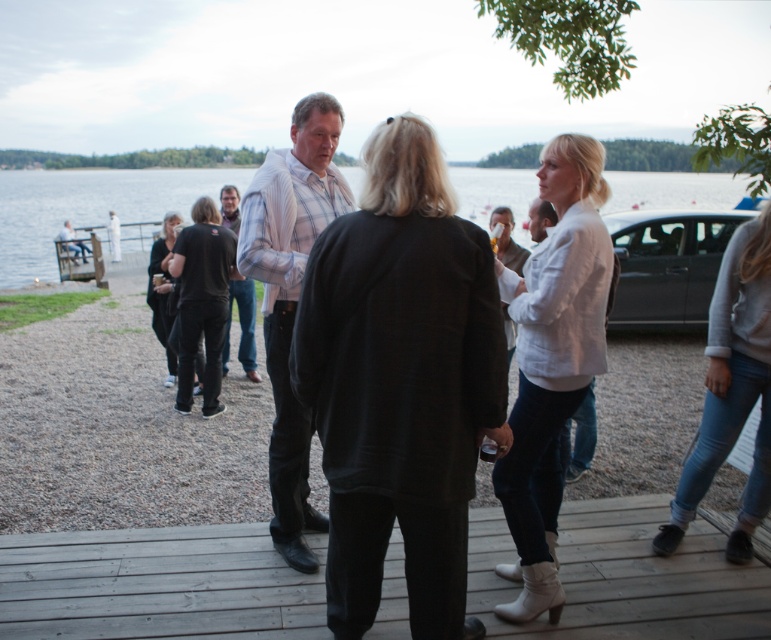
How far apart are wooden at center and denim jeans at lower right?

A distance of 1.92 meters exists between wooden at center and denim jeans at lower right.

Who is positioned more to the left, wooden at center or denim jeans at lower right?

From the viewer's perspective, wooden at center appears more on the left side.

Between point (736, 576) and point (743, 403), which one is positioned in front?

Point (736, 576)

This screenshot has width=771, height=640. I want to click on wooden at center, so [x=155, y=586].

Is wooden at center below light gray striped shirt at center?

Correct, wooden at center is located below light gray striped shirt at center.

Which is below, wooden at center or light gray striped shirt at center?

Positioned lower is wooden at center.

Who is more distant from viewer, (238, 582) or (322, 212)?

The point (238, 582) is behind.

Find the location of a particular element. Image resolution: width=771 pixels, height=640 pixels. wooden at center is located at coordinates (155, 586).

Does transparent water at center appear on the left side of light gray cotton shirt at center?

Incorrect, transparent water at center is not on the left side of light gray cotton shirt at center.

Between transparent water at center and light gray cotton shirt at center, which one has less height?

light gray cotton shirt at center is shorter.

Does point (705, 182) lie behind point (106, 225)?

Yes, point (705, 182) is farther from viewer.

Locate an element on the screen. transparent water at center is located at coordinates (88, 208).